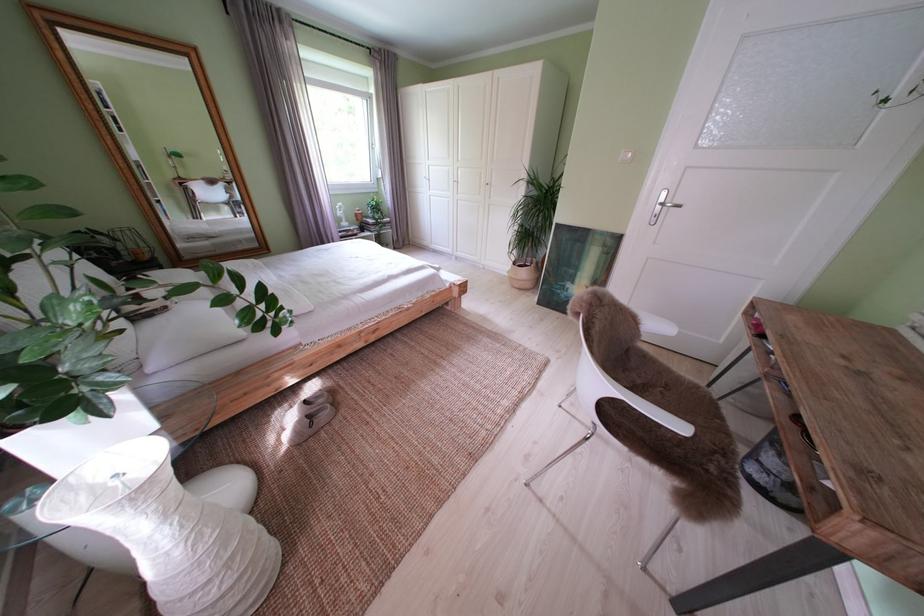
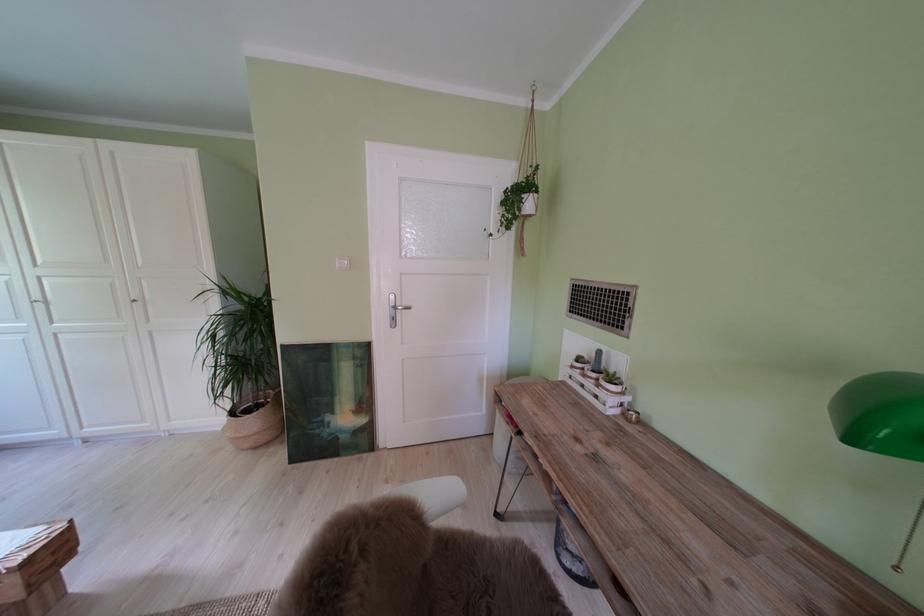
Question: I am providing you with two images of the same scene from different viewpoints. After the viewpoint changes to image2, which objects are now occluded?

Choices:
 (A) wicker plant basket
 (B) lamp pull chain
 (C) white light switch
 (D) none of these

Answer: (D)